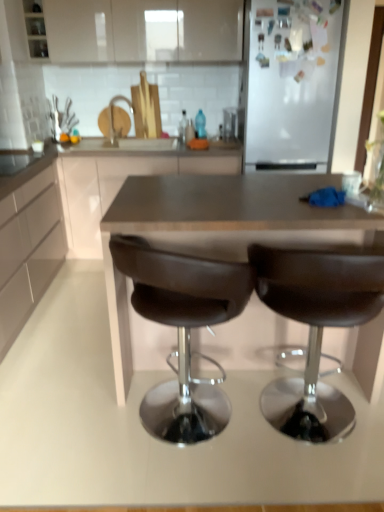
Identify the location of matte brown countertop at center, the 2th cabinetry from the top. (72, 213).

What do you see at coordinates (112, 116) in the screenshot? I see `brushed metal faucet at upper center` at bounding box center [112, 116].

Measure the distance between brown leather chair at center, which ranks as the 1th chair in left-to-right order, and camera.

The distance of brown leather chair at center, which ranks as the 1th chair in left-to-right order, from camera is 4.59 feet.

Locate an element on the screen. The height and width of the screenshot is (512, 384). white glossy cabinet at upper center, marked as the 1th cabinetry in a top-to-bottom arrangement is located at coordinates (143, 30).

Locate an element on the screen. dark brown laminate counter at center is located at coordinates (121, 181).

Considering the sizes of objects matte brown countertop at center, the 2th cabinetry when ordered from bottom to top, and brown leather chair at center, which ranks as the 1th chair in left-to-right order, in the image provided, who is thinner, matte brown countertop at center, the 2th cabinetry when ordered from bottom to top, or brown leather chair at center, which ranks as the 1th chair in left-to-right order,?

Thinner between the two is brown leather chair at center, which ranks as the 1th chair in left-to-right order.

From the image's perspective, which object appears higher, matte brown countertop at center, the 2th cabinetry when ordered from bottom to top, or brown leather chair at center, which ranks as the 1th chair in left-to-right order?

matte brown countertop at center, the 2th cabinetry when ordered from bottom to top.

Is matte brown countertop at center, the 2th cabinetry when ordered from bottom to top, not inside brown leather chair at center, which ranks as the 1th chair in left-to-right order?

matte brown countertop at center, the 2th cabinetry when ordered from bottom to top, is positioned outside brown leather chair at center, which ranks as the 1th chair in left-to-right order.

Considering the sizes of brown leather chair at center, the 2th chair when ordered from left to right, and brown leather chair at center, which is the second chair in right-to-left order, in the image, is brown leather chair at center, the 2th chair when ordered from left to right, bigger or smaller than brown leather chair at center, which is the second chair in right-to-left order,?

Clearly, brown leather chair at center, the 2th chair when ordered from left to right, is smaller in size than brown leather chair at center, which is the second chair in right-to-left order.

Consider the image. Could you measure the distance between brown leather chair at center, the first chair viewed from the right, and brown leather chair at center, which ranks as the 1th chair in left-to-right order?

brown leather chair at center, the first chair viewed from the right, is 27.88 centimeters from brown leather chair at center, which ranks as the 1th chair in left-to-right order.

Does brown leather chair at center, the first chair viewed from the right, touch brown leather chair at center, which is the second chair in right-to-left order?

No, brown leather chair at center, the first chair viewed from the right, is not in contact with brown leather chair at center, which is the second chair in right-to-left order.

Considering the relative positions of brown leather chair at center, the first chair viewed from the right, and brown leather chair at center, which ranks as the 1th chair in left-to-right order, in the image provided, is brown leather chair at center, the first chair viewed from the right, to the left or to the right of brown leather chair at center, which ranks as the 1th chair in left-to-right order,?

From the image, it's evident that brown leather chair at center, the first chair viewed from the right, is to the right of brown leather chair at center, which ranks as the 1th chair in left-to-right order.

From a real-world perspective, between brown leather table at center and white matte cabinet at left, the 3th cabinetry from the top, who is vertically lower?

brown leather table at center is physically lower.

Is brown leather table at center in contact with white matte cabinet at left, the 3th cabinetry from the top?

No, brown leather table at center is not in contact with white matte cabinet at left, the 3th cabinetry from the top.

Is white matte cabinet at left, the 3th cabinetry from the top, located within brown leather table at center?

No, white matte cabinet at left, the 3th cabinetry from the top, is not a part of brown leather table at center.

Is brown leather chair at center, the first chair viewed from the right, next to matte brown countertop at center, the 2th cabinetry from the top, and touching it?

brown leather chair at center, the first chair viewed from the right, is not next to matte brown countertop at center, the 2th cabinetry from the top, and they're not touching.

From a real-world perspective, who is located lower, brown leather chair at center, the 2th chair when ordered from left to right, or matte brown countertop at center, the 2th cabinetry from the top?

In real-world perspective, brown leather chair at center, the 2th chair when ordered from left to right, is lower.

From the image's perspective, is brown leather chair at center, the first chair viewed from the right, over matte brown countertop at center, the 2th cabinetry from the top?

No, from the image's perspective, brown leather chair at center, the first chair viewed from the right, is not on top of matte brown countertop at center, the 2th cabinetry from the top.

Is white matte cabinet at left, the 3th cabinetry from the top, further to the viewer compared to dark brown laminate counter at center?

No, white matte cabinet at left, the 3th cabinetry from the top, is in front of dark brown laminate counter at center.

Is point (45, 233) positioned in front of point (133, 172)?

Yes, point (45, 233) is in front of point (133, 172).

From the image's perspective, is white matte cabinet at left, the first cabinetry ordered from the bottom, above or below dark brown laminate counter at center?

Clearly, from the image's perspective, white matte cabinet at left, the first cabinetry ordered from the bottom, is below dark brown laminate counter at center.

Could you tell me if white matte cabinet at left, the 3th cabinetry from the top, is turned towards dark brown laminate counter at center?

No.

Between brown leather chair at center, the 2th chair when ordered from left to right, and white glossy refrigerator at upper right, which one appears on the right side from the viewer's perspective?

white glossy refrigerator at upper right.

Is brown leather chair at center, the first chair viewed from the right, not within white glossy refrigerator at upper right?

Indeed, brown leather chair at center, the first chair viewed from the right, is completely outside white glossy refrigerator at upper right.

Could you tell me if brown leather chair at center, the first chair viewed from the right, is facing dark brown laminate counter at center?

No, brown leather chair at center, the first chair viewed from the right, is not oriented towards dark brown laminate counter at center.

Is dark brown laminate counter at center a part of brown leather chair at center, the 2th chair when ordered from left to right?

No, dark brown laminate counter at center is located outside of brown leather chair at center, the 2th chair when ordered from left to right.

Does brown leather chair at center, the 2th chair when ordered from left to right, appear on the left side of dark brown laminate counter at center?

Incorrect, brown leather chair at center, the 2th chair when ordered from left to right, is not on the left side of dark brown laminate counter at center.

Which of these two, brown leather chair at center, the first chair viewed from the right, or dark brown laminate counter at center, stands shorter?

Standing shorter between the two is dark brown laminate counter at center.

The width and height of the screenshot is (384, 512). In order to click on chair that is the 1st one when counting forward from the matte brown countertop at center, the 2th cabinetry when ordered from bottom to top in this screenshot , I will do `click(183, 331)`.

Identify the location of chair below the brown leather chair at center, the first chair viewed from the right (from a real-world perspective). The width and height of the screenshot is (384, 512). (183, 331).

Which object lies nearer to the anchor point brushed metal faucet at upper center, white matte cabinet at left, the 3th cabinetry from the top, or matte brown countertop at center, the 2th cabinetry when ordered from bottom to top?

matte brown countertop at center, the 2th cabinetry when ordered from bottom to top, is closer to brushed metal faucet at upper center.

From the picture: Based on their spatial positions, is brown leather chair at center, which ranks as the 1th chair in left-to-right order, or dark brown laminate counter at center further from matte brown countertop at center, the 2th cabinetry from the top?

Based on the image, brown leather chair at center, which ranks as the 1th chair in left-to-right order, appears to be further to matte brown countertop at center, the 2th cabinetry from the top.

Which object lies nearer to the anchor point brushed metal faucet at upper center, dark brown laminate counter at center or white glossy refrigerator at upper right?

dark brown laminate counter at center.

Considering their positions, is brushed metal faucet at upper center positioned closer to brown leather table at center than white matte cabinet at left, the first cabinetry ordered from the bottom?

white matte cabinet at left, the first cabinetry ordered from the bottom, lies closer to brown leather table at center than the other object.

When comparing their distances from brown leather chair at center, the 2th chair when ordered from left to right, does brown leather chair at center, which ranks as the 1th chair in left-to-right order, or brushed metal faucet at upper center seem further?

The object further to brown leather chair at center, the 2th chair when ordered from left to right, is brushed metal faucet at upper center.

Based on their spatial positions, is white matte cabinet at left, the first cabinetry ordered from the bottom, or white glossy cabinet at upper center, which appears as the 3th cabinetry when ordered from the bottom, further from matte brown countertop at center, the 2th cabinetry from the top?

white glossy cabinet at upper center, which appears as the 3th cabinetry when ordered from the bottom, lies further to matte brown countertop at center, the 2th cabinetry from the top, than the other object.

Consider the image. When comparing their distances from brown leather table at center, does white matte cabinet at left, the first cabinetry ordered from the bottom, or brown leather chair at center, which is the second chair in right-to-left order, seem further?

white matte cabinet at left, the first cabinetry ordered from the bottom, is positioned further to the anchor brown leather table at center.

Estimate the real-world distances between objects in this image. Which object is further from brushed metal faucet at upper center, white matte cabinet at left, the first cabinetry ordered from the bottom, or white glossy cabinet at upper center, which appears as the 3th cabinetry when ordered from the bottom?

white matte cabinet at left, the first cabinetry ordered from the bottom, is positioned further to the anchor brushed metal faucet at upper center.

Locate an element on the screen. The height and width of the screenshot is (512, 384). table between brown leather chair at center, the first chair viewed from the right, and brushed metal faucet at upper center, along the z-axis is located at coordinates (220, 229).

At what (x,y) coordinates should I click in order to perform the action: click on silver between white matte cabinet at left, the 3th cabinetry from the top, and white glossy refrigerator at upper right, in the horizontal direction. Please return your answer as a coordinate pair (x, y). The image size is (384, 512). Looking at the image, I should click on (112, 116).

Image resolution: width=384 pixels, height=512 pixels. What are the coordinates of `chair between white matte cabinet at left, the 3th cabinetry from the top, and brown leather table at center, in the horizontal direction` in the screenshot? It's located at pos(183,331).

Find the location of a particular element. fridge positioned between matte brown countertop at center, the 2th cabinetry when ordered from bottom to top, and brushed metal faucet at upper center from near to far is located at coordinates (293, 83).